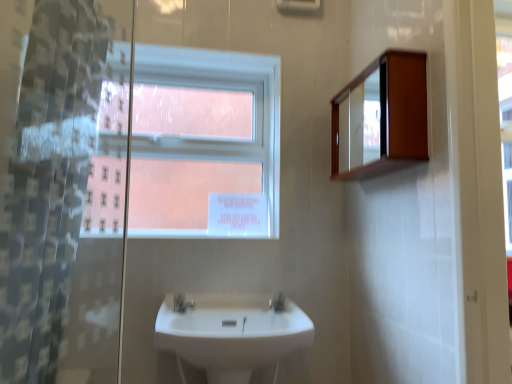
Question: In terms of size, does white glossy sink at center appear bigger or smaller than silver metallic tap at center, which is counted as the first tap, starting from the left?

Choices:
 (A) small
 (B) big

Answer: (B)

Question: From a real-world perspective, is white glossy sink at center physically located above or below silver metallic tap at center, which is counted as the first tap, starting from the left?

Choices:
 (A) above
 (B) below

Answer: (B)

Question: Which object is positioned farthest from the silver metallic tap at center, which is counted as the first tap, starting from the left?

Choices:
 (A) white glossy sink at center
 (B) clear plastic shower curtain at left
 (C) white glossy tap at center, the 1th tap viewed from the right
 (D) wooden medicine cabinet at upper right
 (E) white plastic window at upper center

Answer: (D)

Question: Which object is positioned farthest from the white plastic window at upper center?

Choices:
 (A) wooden medicine cabinet at upper right
 (B) white glossy tap at center, the 1th tap viewed from the right
 (C) silver metallic tap at center, which is counted as the first tap, starting from the left
 (D) clear plastic shower curtain at left
 (E) white glossy sink at center

Answer: (B)